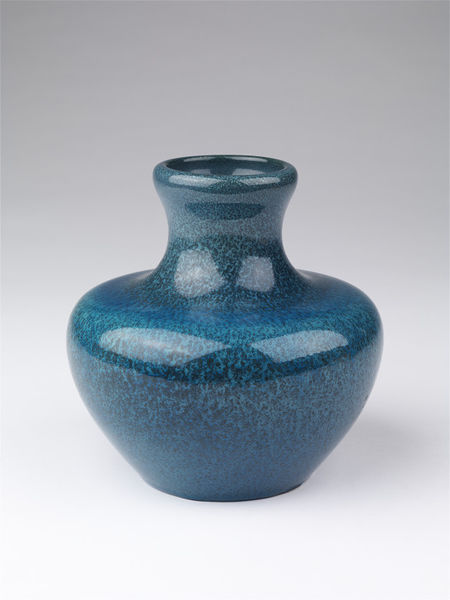
Locate an element on the screen. table is located at coordinates (51, 477).